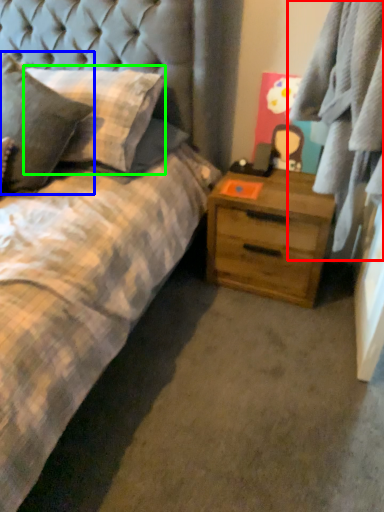
Question: Which object is positioned closest to plaid (highlighted by a red box)? Select from pillow (highlighted by a blue box) and pillow (highlighted by a green box).

Choices:
 (A) pillow
 (B) pillow

Answer: (B)